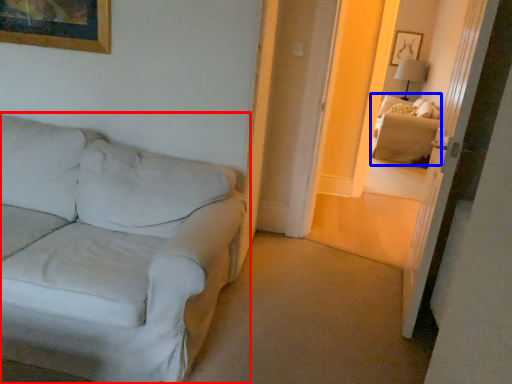
Question: Which of the following is the farthest to the observer, studio couch (highlighted by a red box) or couch (highlighted by a blue box)?

Choices:
 (A) studio couch
 (B) couch

Answer: (B)